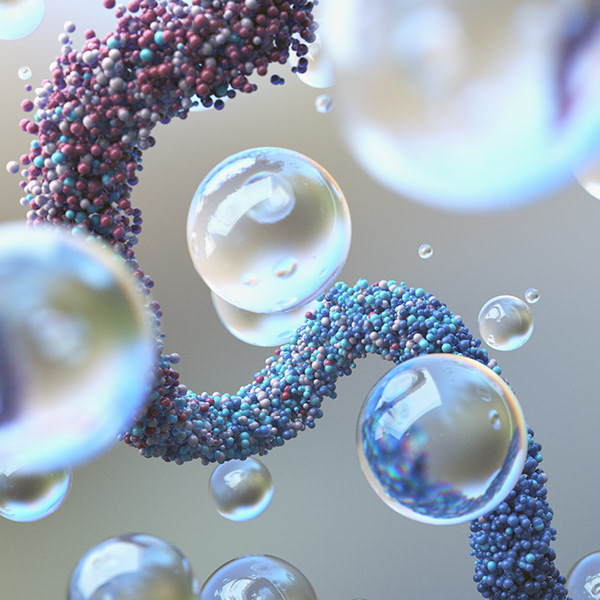
You are a GUI agent. You are given a task and a screenshot of the screen. Output one action in this format:
    pyautogui.click(x=<x>, y=<y>)
    Task: Click on the reflection of window
    Image resolution: width=600 pixels, height=600 pixels.
    Given the screenshot: What is the action you would take?
    pyautogui.click(x=415, y=404), pyautogui.click(x=235, y=219), pyautogui.click(x=227, y=482), pyautogui.click(x=90, y=563), pyautogui.click(x=494, y=311)